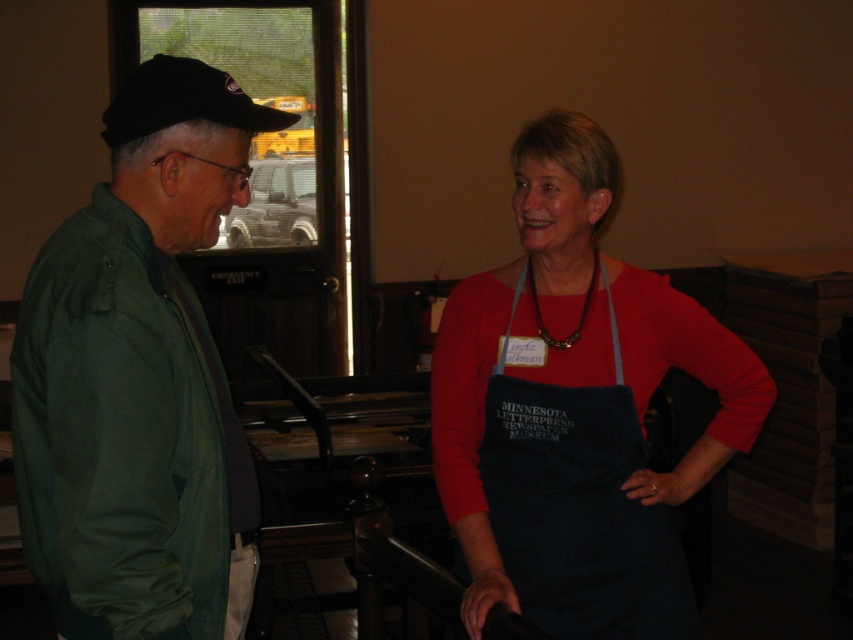
Who is positioned more to the right, green matte jacket at left or denim apron at center?

denim apron at center is more to the right.

Measure the distance between green matte jacket at left and camera.

They are 1.35 meters apart.

The height and width of the screenshot is (640, 853). Find the location of `green matte jacket at left`. green matte jacket at left is located at coordinates (138, 378).